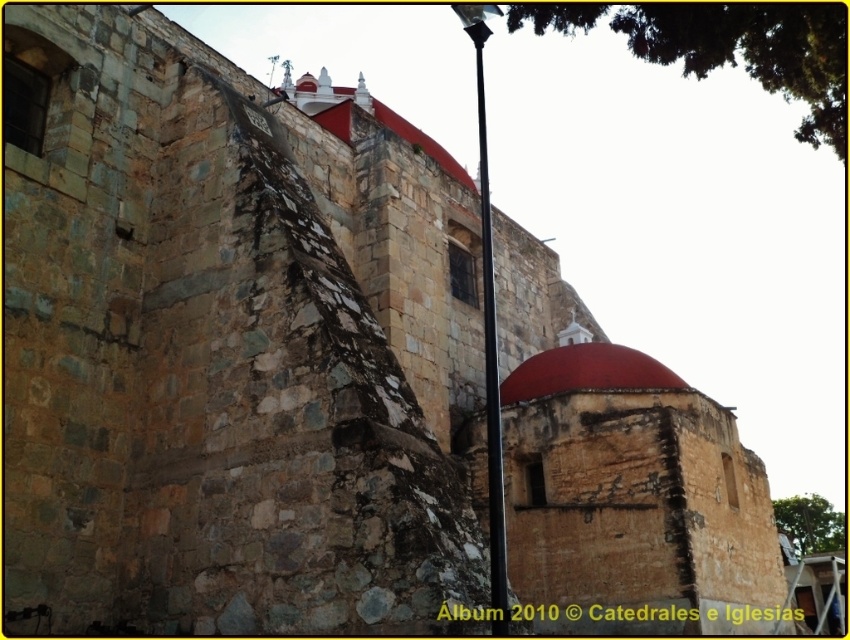
Question: Is smooth stone dome at center further to the viewer compared to red stone dome at center?

Choices:
 (A) no
 (B) yes

Answer: (A)

Question: Among these objects, which one is farthest from the camera?

Choices:
 (A) red stone dome at center
 (B) smooth stone dome at center

Answer: (A)

Question: Which point is closer to the camera?

Choices:
 (A) (564, 532)
 (B) (544, 353)

Answer: (A)

Question: Which point is farther to the camera?

Choices:
 (A) (527, 381)
 (B) (588, 388)

Answer: (A)

Question: Is smooth stone dome at center further to camera compared to red stone dome at center?

Choices:
 (A) no
 (B) yes

Answer: (A)

Question: From the image, what is the correct spatial relationship of smooth stone dome at center in relation to red stone dome at center?

Choices:
 (A) left
 (B) right

Answer: (B)